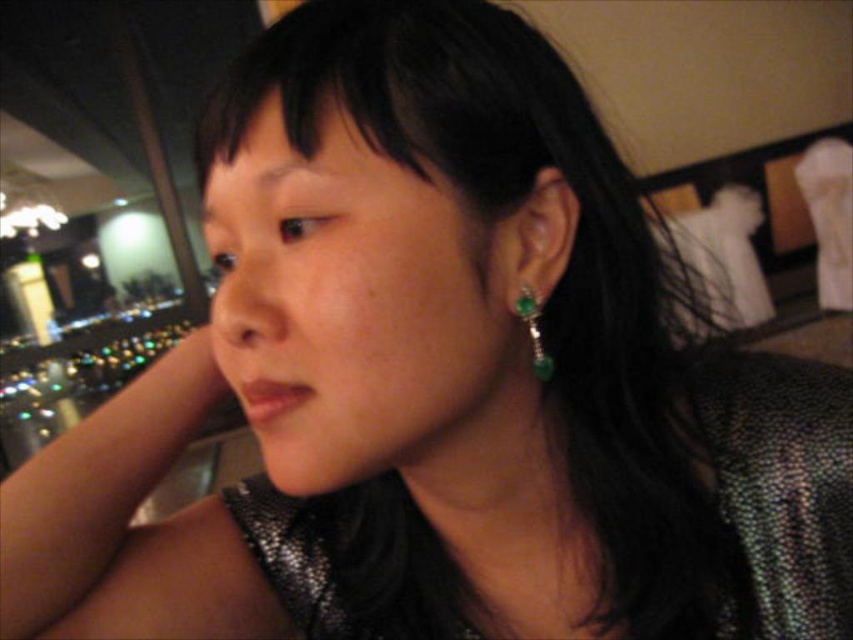
Question: Does black shiny hair at center appear on the right side of emerald-green gemstone at ear?

Choices:
 (A) yes
 (B) no

Answer: (A)

Question: Which point appears closest to the camera in this image?

Choices:
 (A) (573, 477)
 (B) (534, 369)

Answer: (B)

Question: Is black shiny hair at center thinner than emerald-green gemstone at ear?

Choices:
 (A) no
 (B) yes

Answer: (A)

Question: Which object is closer to the camera taking this photo?

Choices:
 (A) black shiny hair at center
 (B) emerald-green gemstone at ear

Answer: (A)

Question: Does black shiny hair at center appear under emerald-green gemstone at ear?

Choices:
 (A) yes
 (B) no

Answer: (B)